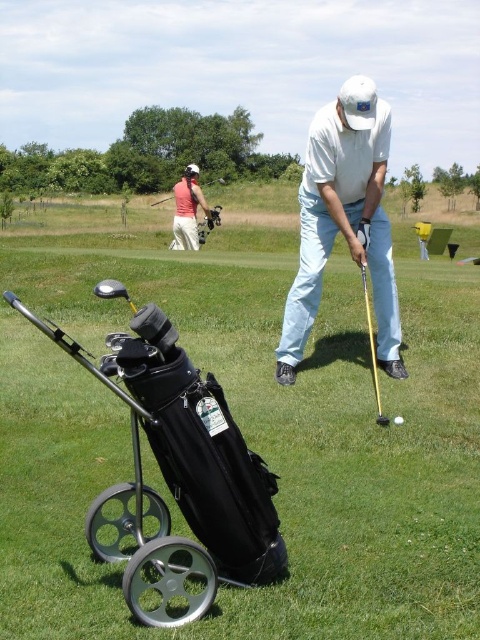
Can you confirm if black fabric golf bag at lower left is taller than white matte golf ball at center?

Yes, black fabric golf bag at lower left is taller than white matte golf ball at center.

Does black fabric golf bag at lower left have a lesser height compared to white matte golf ball at center?

No.

Which is behind, point (475, 476) or point (403, 422)?

The point (403, 422) is more distant.

Find the location of a particular element. black fabric golf bag at lower left is located at coordinates (245, 429).

Is metallic gold shaft at center to the left of white matte golf ball at center from the viewer's perspective?

Correct, you'll find metallic gold shaft at center to the left of white matte golf ball at center.

Between point (365, 304) and point (399, 417), which one is positioned behind?

Positioned behind is point (365, 304).

You are a GUI agent. You are given a task and a screenshot of the screen. Output one action in this format:
    pyautogui.click(x=<x>, y=<y>)
    Task: Click on the metallic gold shaft at center
    The image size is (480, 640).
    Given the screenshot: What is the action you would take?
    pyautogui.click(x=372, y=352)

Does matte pink shirt at upper left have a lesser width compared to matte black golf club at center?

Yes.

Looking at this image, does matte pink shirt at upper left appear under matte black golf club at center?

Correct, matte pink shirt at upper left is located below matte black golf club at center.

Where is `matte pink shirt at upper left`? This screenshot has height=640, width=480. matte pink shirt at upper left is located at coordinates (189, 211).